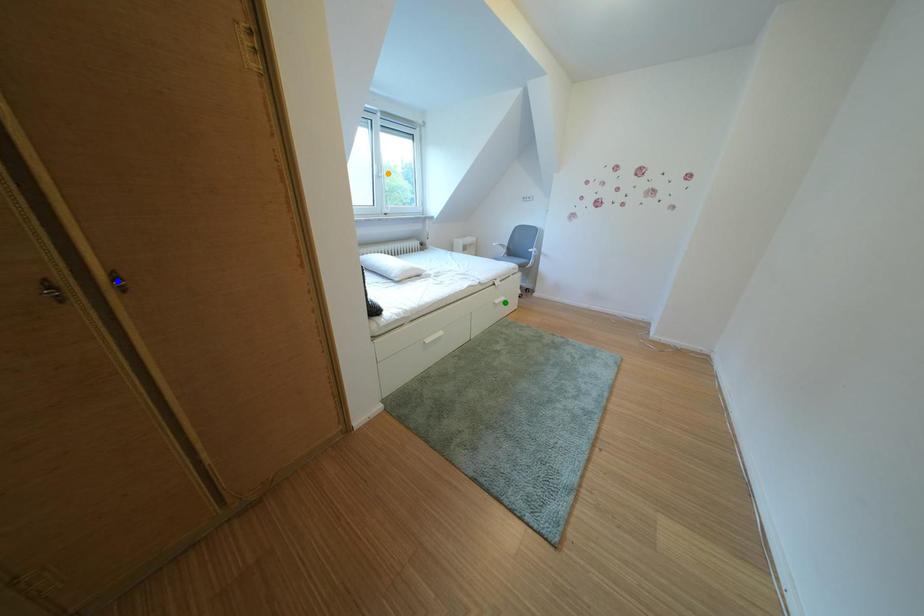
Order these from nearest to farthest:
blue point
orange point
green point

blue point
green point
orange point